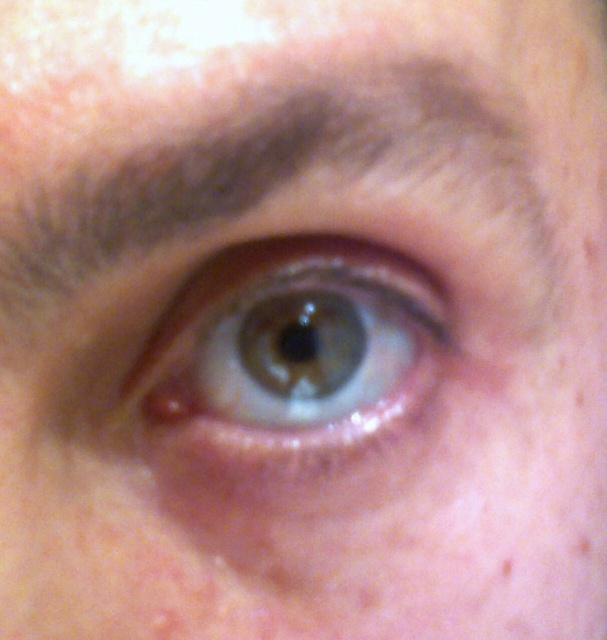
How distant is brown fuzzy eyebrow at upper center from green matte eye at center?

1.39 inches

From the picture: Who is more distant from viewer, (492, 262) or (174, 339)?

The point (492, 262) is more distant.

Find the location of a particular element. The height and width of the screenshot is (640, 607). brown fuzzy eyebrow at upper center is located at coordinates (276, 172).